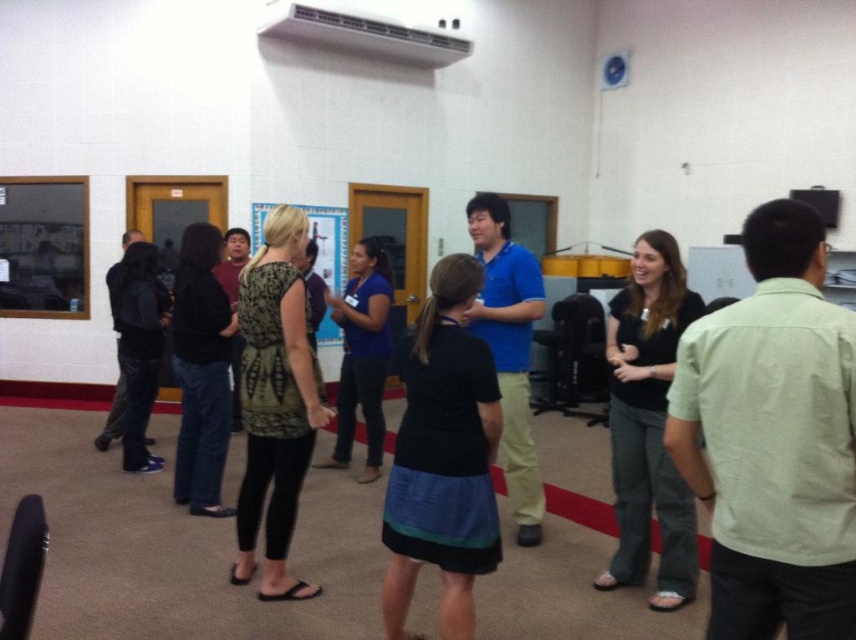
You are standing in the room and want to move from point (x=776, y=355) to point (x=658, y=316). Which direction should you move to get closer to the window?

Since point (x=776, y=355) is closer to the viewer than point (x=658, y=316), you should move away from the window to reach the second point.

You are organizing a fashion show and need to decide which outfit to display first. The black matte dress at center and the black matte pants at right are both options. Based on their sizes, which one should you choose if you want to start with the larger piece?

The black matte pants at right are larger in size compared to the black matte dress at center, so you should choose the black matte pants at right to display first if you want to start with the larger piece.

You are a person who is 1.7 meters tall. You are standing in the room and want to reach the light green cotton shirt at center and the black matte pants at right. Which one is closer to you?

The light green cotton shirt at center is closer to you since it is only 1.21 meters away from the black matte pants at right, so the shirt is nearer than the pants.